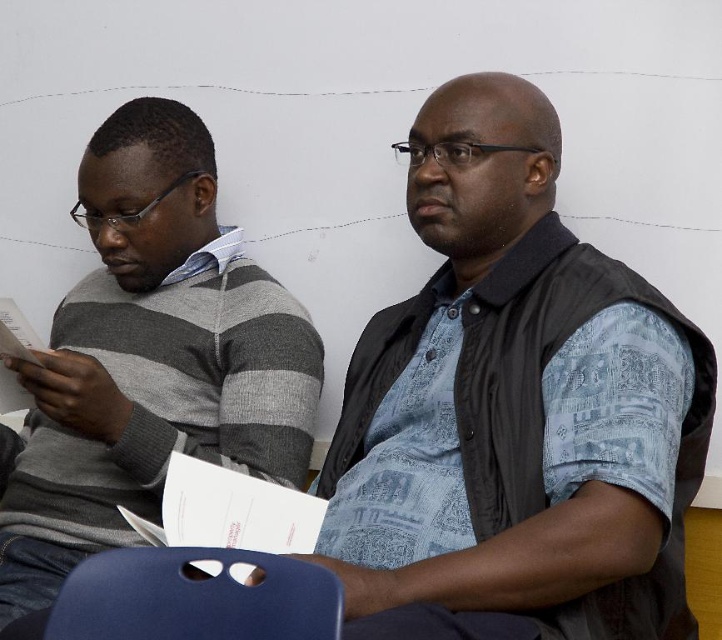
You are organizing a photo shoot and need to arrange two models wearing the blue printed shirt at center and the gray striped sweater at left. Based on their heights, which model should stand closer to the camera to create a balanced composition?

The blue printed shirt at center is shorter than the gray striped sweater at left, so the model wearing the blue printed shirt at center should stand closer to the camera to appear taller and balance the composition.